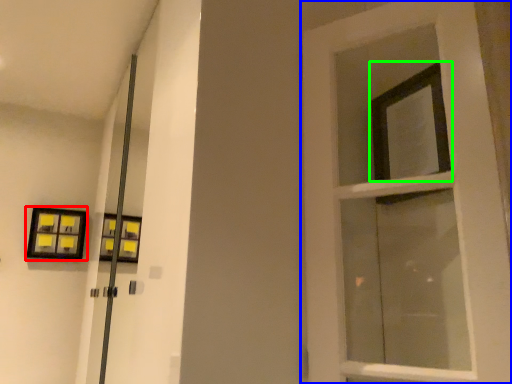
Question: Estimate the real-world distances between objects in this image. Which object is closer to picture frame (highlighted by a red box), door (highlighted by a blue box) or window (highlighted by a green box)?

Choices:
 (A) door
 (B) window

Answer: (A)